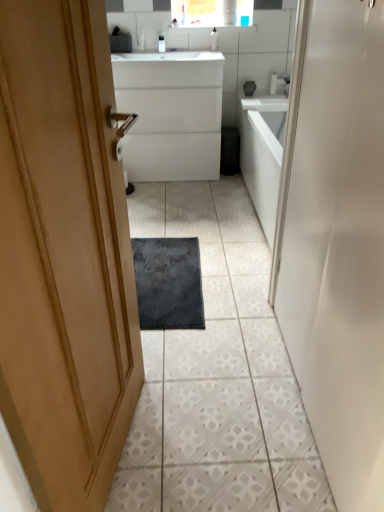
Question: Is dark gray textured bath mat at center in front of or behind white glossy cabinet at center in the image?

Choices:
 (A) behind
 (B) front

Answer: (B)

Question: From the image's perspective, is dark gray textured bath mat at center above or below white glossy cabinet at center?

Choices:
 (A) below
 (B) above

Answer: (A)

Question: Which object is the closest to the matte white faucet at upper center?

Choices:
 (A) white glossy door at center
 (B) white textured tile at center
 (C) dark gray textured bath mat at center
 (D) white glossy cabinet at center
 (E) white glossy soap dispenser at upper center, placed as the second toiletry when sorted from left to right

Answer: (E)

Question: Which is farther from the white glossy door at center?

Choices:
 (A) matte white faucet at upper center
 (B) white glossy soap dispenser at upper center, placed as the second toiletry when sorted from left to right
 (C) white glossy soap dispenser at upper center, which ranks as the 2th toiletry in right-to-left order
 (D) white textured tile at center
 (E) white glossy cabinet at center

Answer: (A)